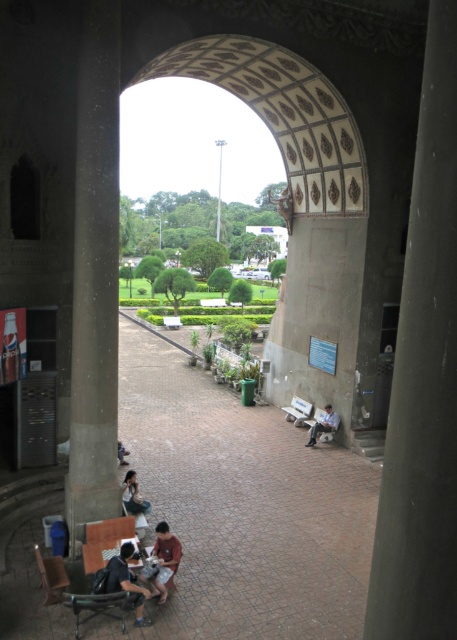
Question: Which of the following is the farthest from the observer?

Choices:
 (A) wooden park bench at center
 (B) brown leather jacket at lower center
 (C) dark gray concrete pillar at center
 (D) dark blue jeans at lower center

Answer: (A)

Question: Does dark blue shirt at lower left have a lesser width compared to brown leather jacket at lower center?

Choices:
 (A) yes
 (B) no

Answer: (B)

Question: Which point is closer to the camera taking this photo?

Choices:
 (A) (158, 529)
 (B) (111, 177)
 (C) (319, 432)

Answer: (A)

Question: Is gray concrete pillar at left further to the viewer compared to dark blue jeans at lower center?

Choices:
 (A) yes
 (B) no

Answer: (B)

Question: Is brown leather jacket at lower center to the right of wooden park bench at center from the viewer's perspective?

Choices:
 (A) yes
 (B) no

Answer: (B)

Question: Which object appears farthest from the camera in this image?

Choices:
 (A) brown leather jacket at lower center
 (B) matte black dress at lower center

Answer: (B)